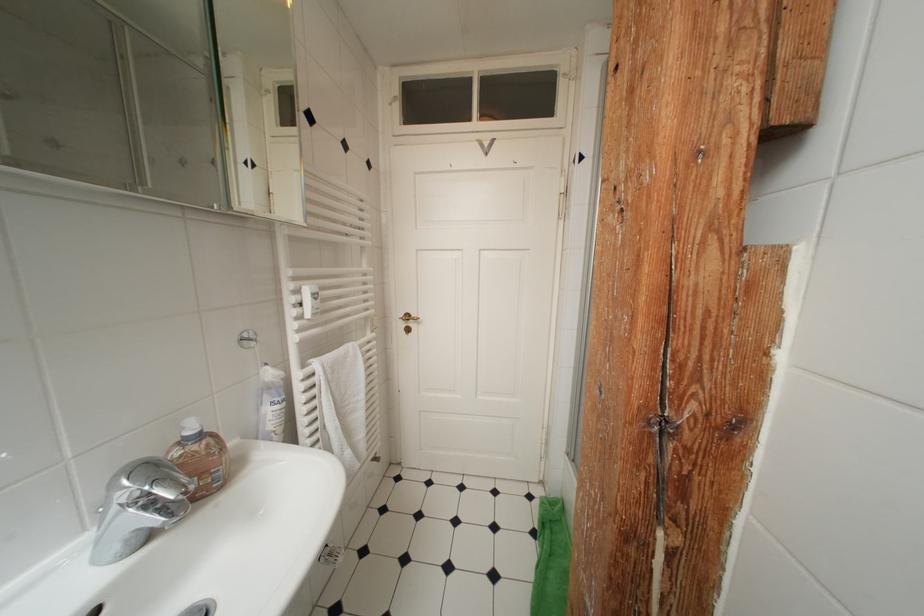
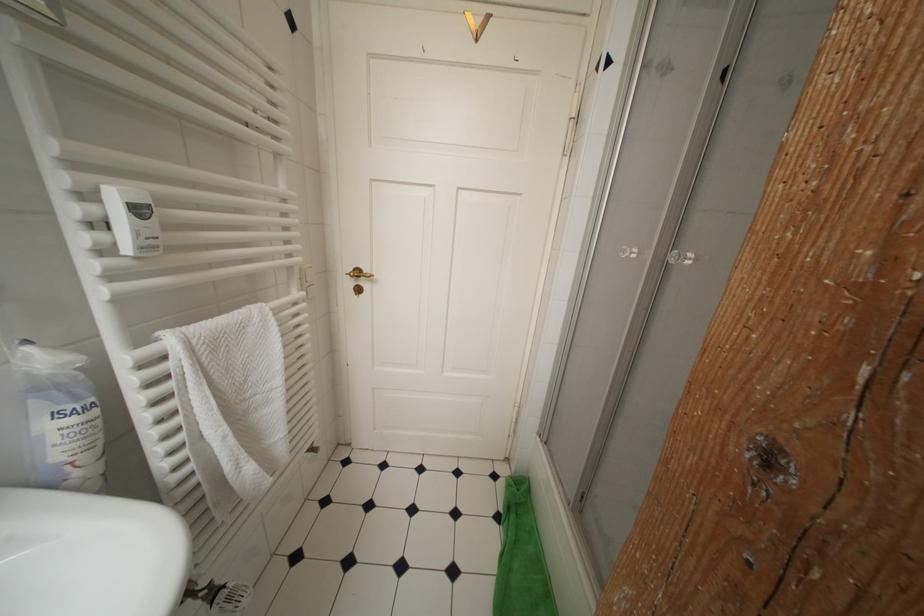
Question: How did the camera likely rotate?

Choices:
 (A) Left
 (B) Right
 (C) Up
 (D) Down

Answer: (D)